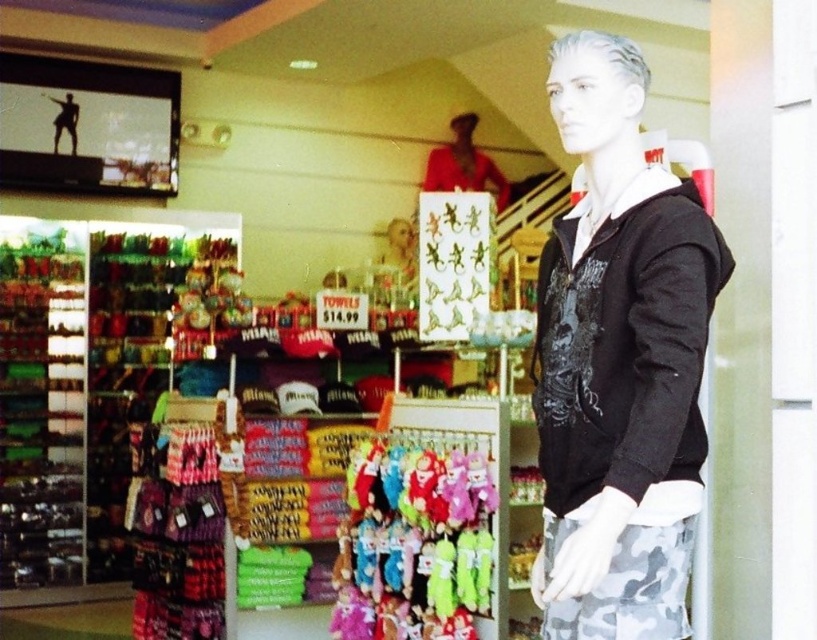
Question: Estimate the real-world distances between objects in this image. Which object is closer to the black matte hoodie at center?

Choices:
 (A) matte red shirt at upper center
 (B) velvet plush toys at center

Answer: (B)

Question: Which is farther from the velvet plush toys at center?

Choices:
 (A) black matte hoodie at center
 (B) matte red shirt at upper center

Answer: (B)

Question: Which object appears farthest from the camera in this image?

Choices:
 (A) black matte hoodie at center
 (B) velvet plush toys at center
 (C) matte red shirt at upper center

Answer: (C)

Question: Can you confirm if black matte hoodie at center is positioned to the right of velvet plush toys at center?

Choices:
 (A) no
 (B) yes

Answer: (B)

Question: Does black matte hoodie at center have a smaller size compared to velvet plush toys at center?

Choices:
 (A) no
 (B) yes

Answer: (B)

Question: Can you confirm if velvet plush toys at center is positioned below matte red shirt at upper center?

Choices:
 (A) no
 (B) yes

Answer: (B)